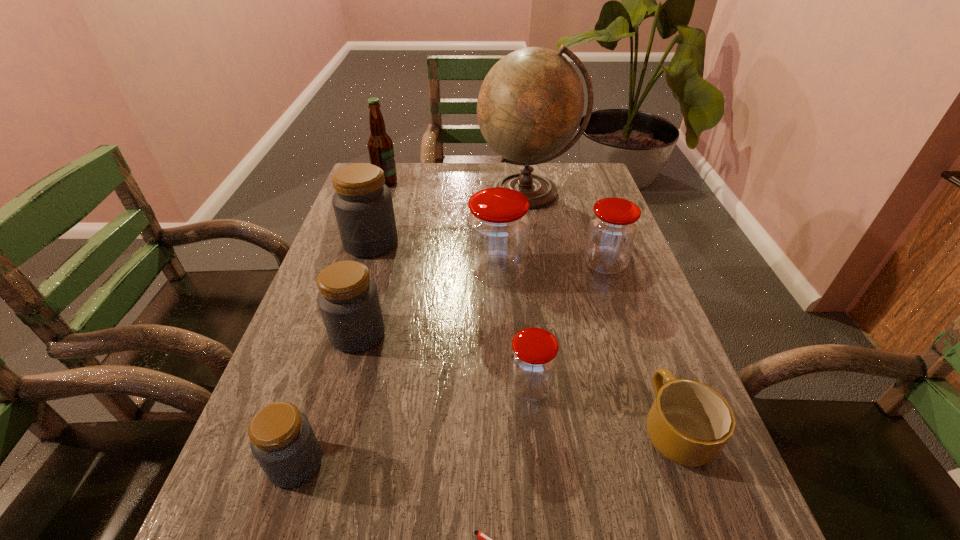
You are a GUI agent. You are given a task and a screenshot of the screen. Output one action in this format:
    pyautogui.click(x=<x>, y=<y>)
    Task: Click on the globe
    This screenshot has width=960, height=540.
    Given the screenshot: What is the action you would take?
    pyautogui.click(x=531, y=102)

This screenshot has height=540, width=960. Identify the location of brown beer bottle. (380, 146).

The height and width of the screenshot is (540, 960). In order to click on beer bottle in this screenshot , I will do `click(380, 146)`.

Find the location of a particular element. the farthest gray jar is located at coordinates (363, 206).

At what (x,y) coordinates should I click in order to perform the action: click on the biggest red jar. Please return your answer as a coordinate pair (x, y). The width and height of the screenshot is (960, 540). Looking at the image, I should click on (498, 224).

Identify the location of the rightmost red jar. This screenshot has width=960, height=540. (613, 226).

Where is `the second biggest red jar`? the second biggest red jar is located at coordinates (613, 226).

This screenshot has height=540, width=960. What are the coordinates of `the sixth farthest object` in the screenshot? It's located at (348, 299).

Where is `the third nearest jar`? the third nearest jar is located at coordinates (348, 299).

Where is `the nearest red jar`? The image size is (960, 540). the nearest red jar is located at coordinates (533, 361).